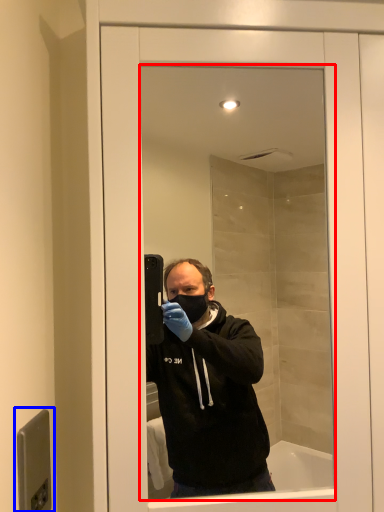
Question: Which point is closer to the camera, mirror (highlighted by a red box) or door handle (highlighted by a blue box)?

Choices:
 (A) mirror
 (B) door handle

Answer: (B)